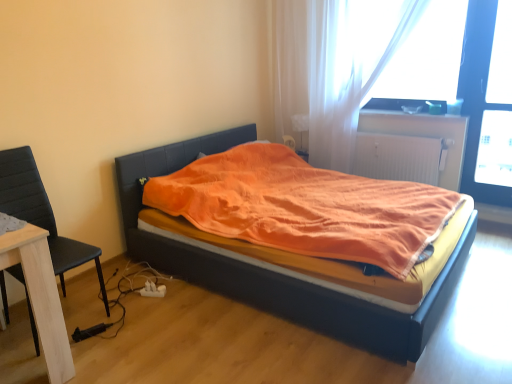
Locate an element on the screen. Image resolution: width=512 pixels, height=384 pixels. vacant space in between black leather chair at left and orange fabric bed at center is located at coordinates (202, 332).